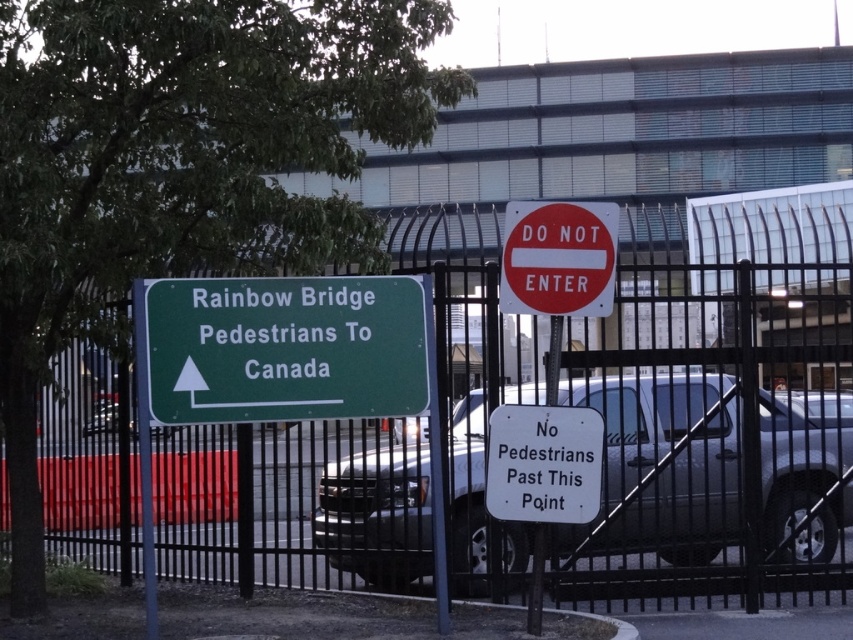
You are standing at the Rainbow Bridge border crossing area and notice the black metal fence at center. According to the scene description, where exactly is this fence positioned in relation to the other elements?

The black metal fence at center is located at point 0.700 in the x coordinate and 0.570 in the y coordinate.

You are a pedestrian at the Rainbow Bridge border crossing and see a silver metallic truck at center and a white plastic sign at center. According to the scene description, which object is located to the right of the other?

The silver metallic truck at center is positioned on the right side of white plastic sign at center, so the silver metallic truck at center is to the right of the white plastic sign at center.

You are a pedestrian at the Rainbow Bridge border crossing and see the green metallic sign at upper left and the red matte sign at center. According to their positions, which direction should you head towards to follow the pedestrian instructions for Canada?

The green metallic sign at upper left, which directs pedestrians to Canada, is positioned on the left side of the red matte sign at center. Since the green sign points upwards and to the right towards the bridge, you should follow the direction indicated by the green metallic sign at upper left towards the right to proceed to Canada.